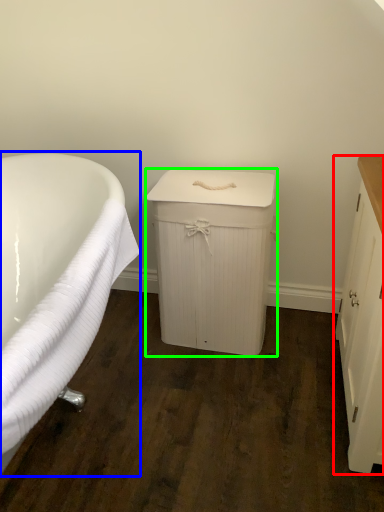
Question: Based on their relative distances, which object is nearer to cabinetry (highlighted by a red box)? Choose from bathtub (highlighted by a blue box) and cabinetry (highlighted by a green box).

Choices:
 (A) bathtub
 (B) cabinetry

Answer: (B)